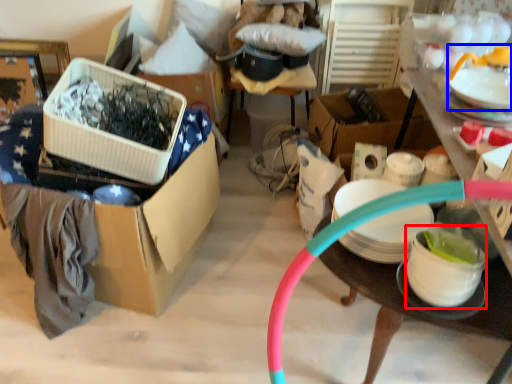
Question: Which point is further to the camera, tableware (highlighted by a red box) or tableware (highlighted by a blue box)?

Choices:
 (A) tableware
 (B) tableware

Answer: (B)